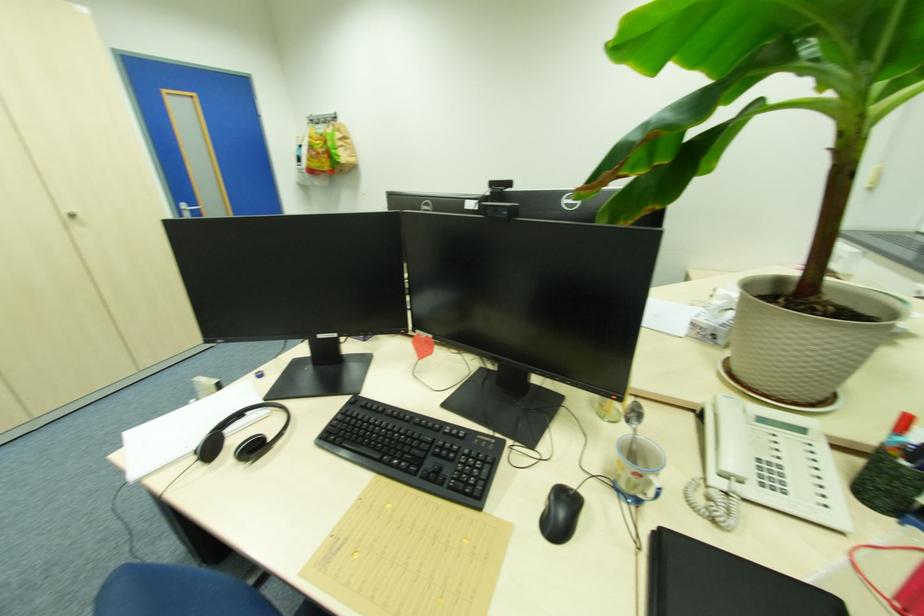
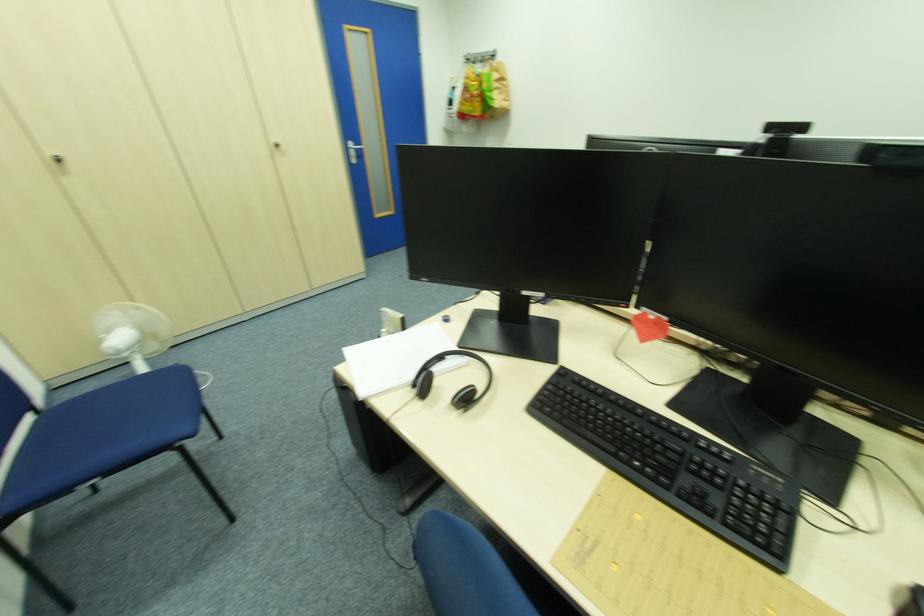
Find the pixel in the second image that matches (x=251, y=415) in the first image.

(454, 359)